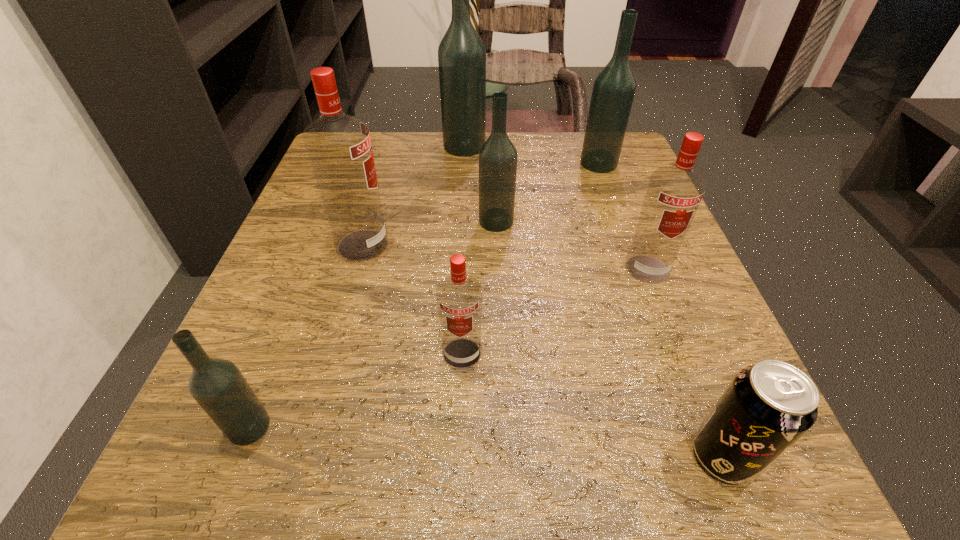
What are the coordinates of `the tallest vodka` in the screenshot? It's located at (461, 53).

Locate an element on the screen. Image resolution: width=960 pixels, height=540 pixels. the tallest object is located at coordinates (461, 53).

This screenshot has width=960, height=540. I want to click on the third smallest black vodka, so click(614, 87).

The height and width of the screenshot is (540, 960). What are the coordinates of `the second vodka from left to right` in the screenshot? It's located at (339, 148).

Where is `the biggest red vodka`? This screenshot has width=960, height=540. the biggest red vodka is located at coordinates (339, 148).

The height and width of the screenshot is (540, 960). I want to click on the second nearest black vodka, so click(x=498, y=156).

Locate an element on the screen. This screenshot has width=960, height=540. the second smallest red vodka is located at coordinates (674, 193).

Locate an element on the screen. the nearest red vodka is located at coordinates (459, 296).

Locate an element on the screen. Image resolution: width=960 pixels, height=540 pixels. the third nearest object is located at coordinates (459, 296).

At what (x,y) coordinates should I click in order to perform the action: click on the leftmost object. Please return your answer as a coordinate pair (x, y). The image size is (960, 540). Looking at the image, I should click on (217, 385).